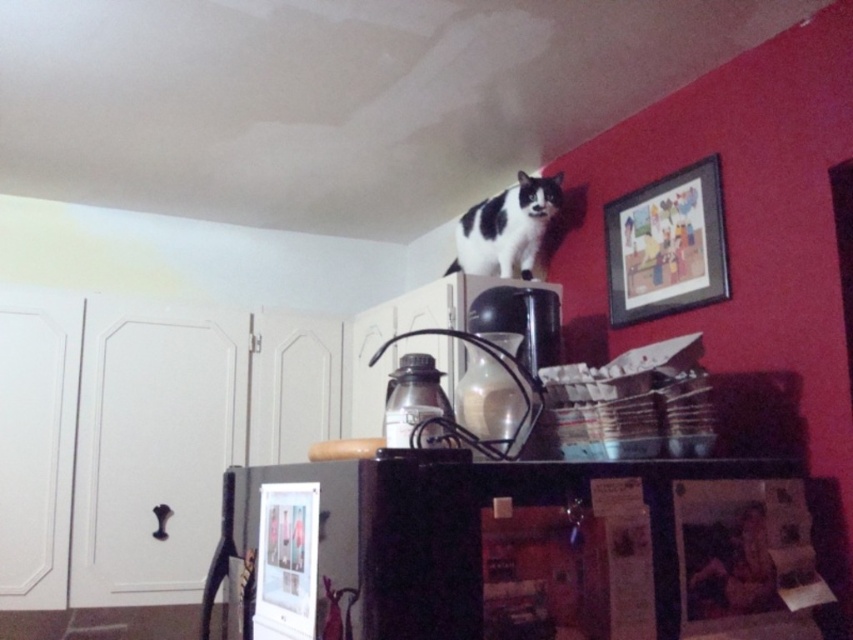
You are trying to hang a new picture on the wall in the kitchen. The current wooden framed artwork at upper right is already there. If you want to place a new picture that is the same size as the black and white fur cat at upper center, where should you place it in relation to the existing artwork?

Since the wooden framed artwork at upper right is taller than the black and white fur cat at upper center, you should place the new picture below the existing artwork to ensure it doesn

You are a painter standing at the edge of the countertop. You want to reach both the wooden framed artwork at upper right and the black and white fur cat at upper center. Which object is closer to you?

The black and white fur cat at upper center is closer to you since the distance between them is 33.83 centimeters, but without knowing the exact positions, we can infer the cat is nearer as it is at upper center while the artwork is at upper right.